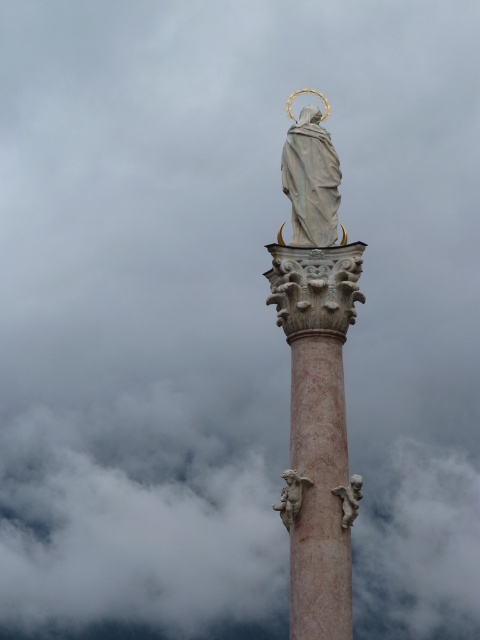
Question: Observing the image, what is the correct spatial positioning of smooth white statue at center in reference to matte stone cherub at lower center?

Choices:
 (A) above
 (B) below

Answer: (A)

Question: Does white marble statue at center appear on the left side of pink marble cherub at center?

Choices:
 (A) no
 (B) yes

Answer: (A)

Question: Is pink marble cherub at center behind white marble cherub at lower center?

Choices:
 (A) yes
 (B) no

Answer: (B)

Question: Which point is farther to the camera?

Choices:
 (A) white marble cherub at lower center
 (B) matte stone cherub at lower center
 (C) white marble statue at center
 (D) pink marble cherub at center

Answer: (A)

Question: Based on their relative distances, which object is nearer to the white marble statue at center?

Choices:
 (A) white fluffy clouds at center
 (B) matte stone cherub at lower center
 (C) white marble cherub at lower center

Answer: (C)

Question: Which point is closer to the camera?

Choices:
 (A) (211, 550)
 (B) (317, 243)

Answer: (B)